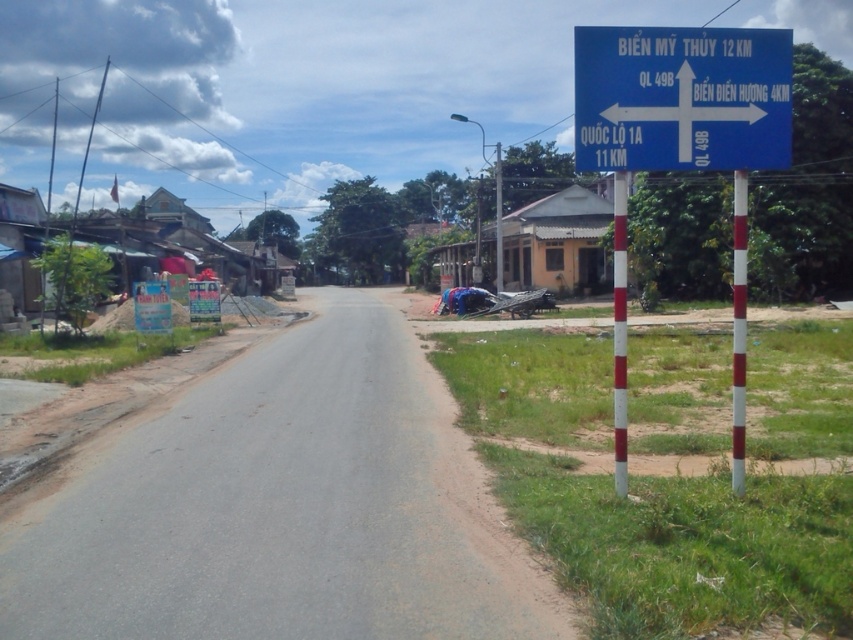
Question: Is red and white striped pole at center-right further to the viewer compared to white striped pole at right?

Choices:
 (A) yes
 (B) no

Answer: (A)

Question: Is red and white striped pole at center-right wider than white striped pole at right?

Choices:
 (A) no
 (B) yes

Answer: (A)

Question: Based on their relative distances, which object is nearer to the blue plastic sign at upper right?

Choices:
 (A) blue plastic signpost at right
 (B) white striped pole at right

Answer: (A)

Question: Which is farther from the white striped pole at right?

Choices:
 (A) blue plastic sign at upper right
 (B) red and white striped pole at center-right
 (C) blue plastic signpost at right

Answer: (A)

Question: Is blue plastic sign at upper right bigger than white striped pole at right?

Choices:
 (A) yes
 (B) no

Answer: (A)

Question: Which of the following is the closest to the observer?

Choices:
 (A) red and white striped pole at center-right
 (B) blue plastic signpost at right
 (C) blue plastic sign at upper right

Answer: (B)